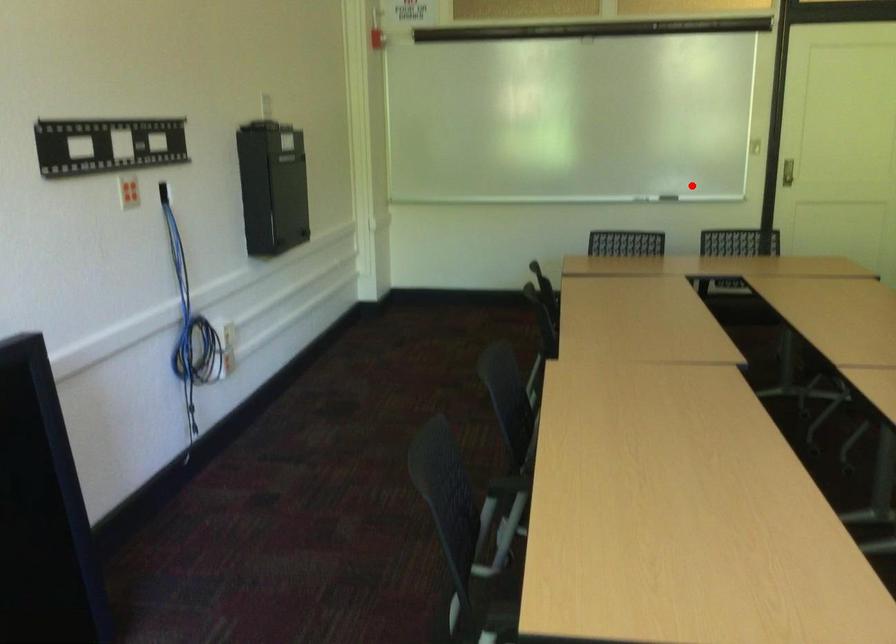
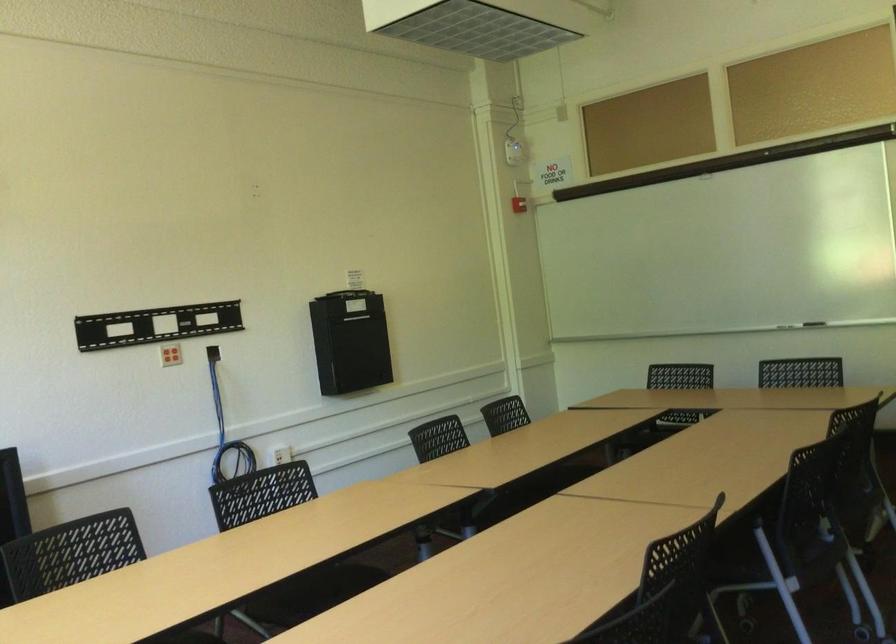
Question: A red point is marked in image1. In image2, is the corresponding 3D point closer to the camera or farther? Reply with the corresponding letter.

Choices:
 (A) The corresponding 3D point is closer.
 (B) The corresponding 3D point is farther.

Answer: (A)